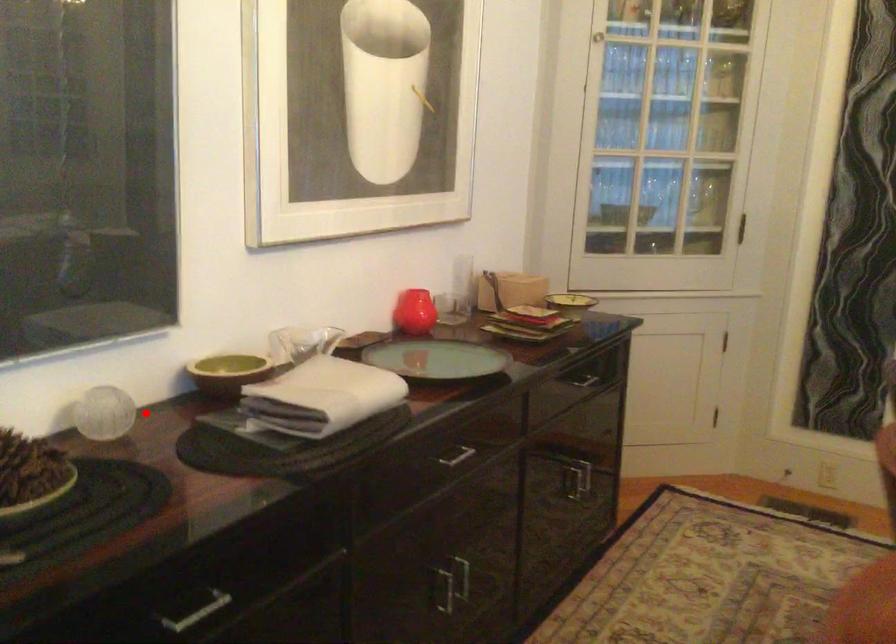
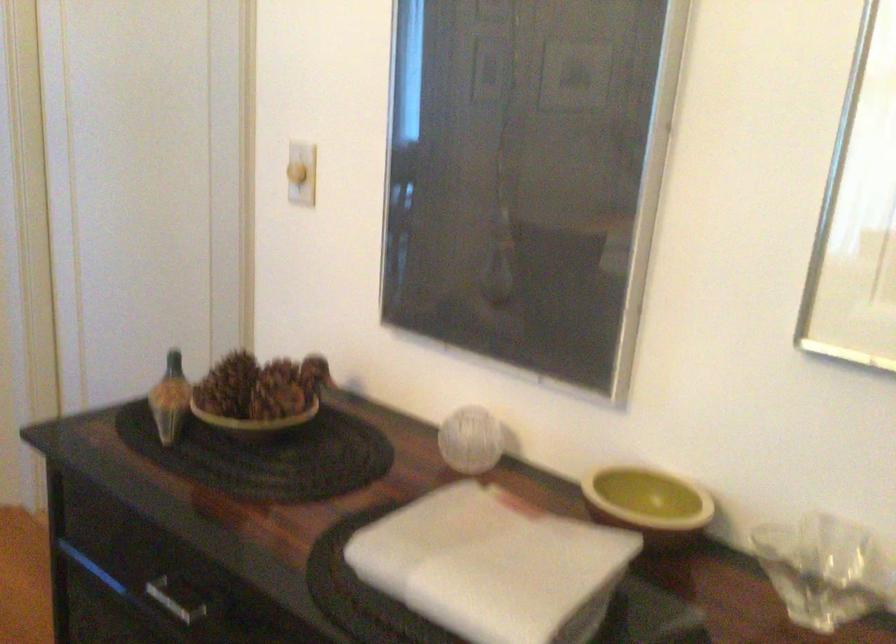
Question: I am providing you with two images of the same scene from different viewpoints. In image1, a red point is highlighted. Considering the same 3D point in image2, which of the following is correct?

Choices:
 (A) It is closer
 (B) It is farther

Answer: (A)